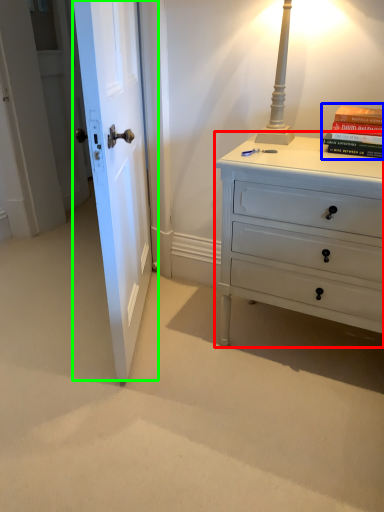
Question: Estimate the real-world distances between objects in this image. Which object is closer to chest of drawers (highlighted by a red box), paperback book (highlighted by a blue box) or door (highlighted by a green box)?

Choices:
 (A) paperback book
 (B) door

Answer: (A)